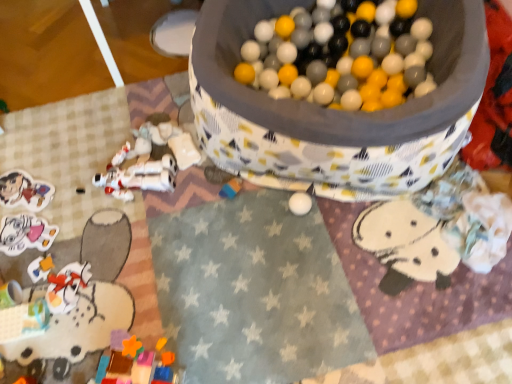
At what (x,y) coordinates should I click in order to perform the action: click on free area in between matte cardboard sticker at lower left, which is the sixth toy from right to left, and multicolored plastic blocks at center, the 2th toy positioned from the right. Please return your answer as a coordinate pair (x, y). The height and width of the screenshot is (384, 512). Looking at the image, I should click on (121, 196).